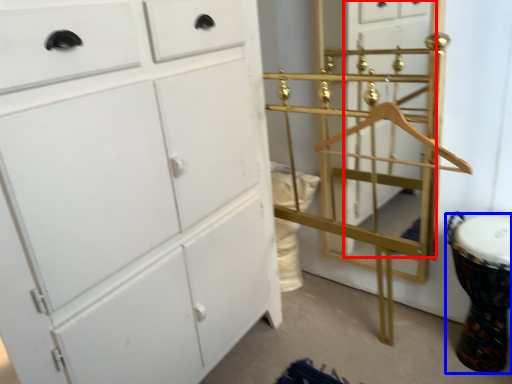
Question: Which object is closer to the camera taking this photo, glass door (highlighted by a red box) or drum (highlighted by a blue box)?

Choices:
 (A) glass door
 (B) drum

Answer: (B)